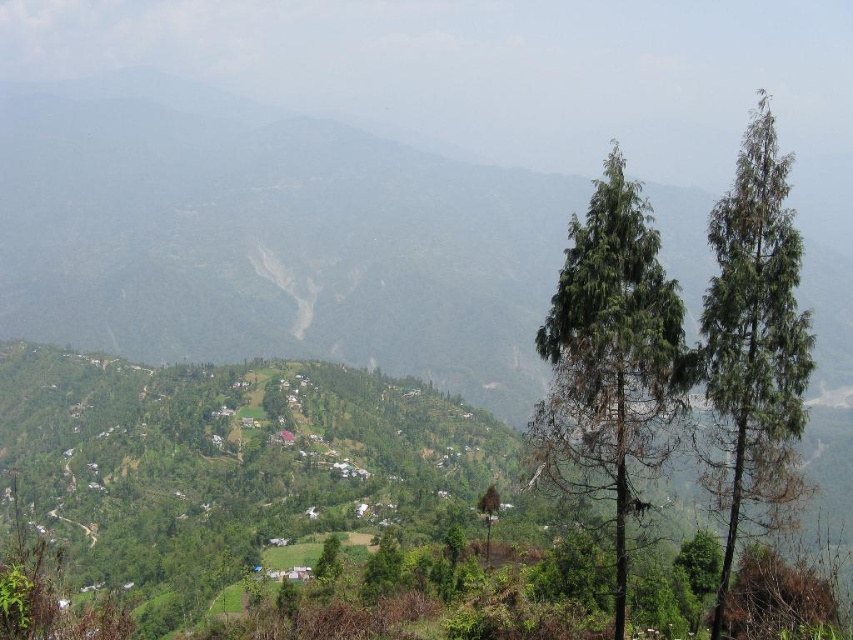
Question: Which object is closer to the camera taking this photo?

Choices:
 (A) green needle-like tree at right
 (B) green matte tree at right

Answer: (B)

Question: Can you confirm if green leafy mountain at center is wider than green needle-like tree at right?

Choices:
 (A) yes
 (B) no

Answer: (A)

Question: Which point is closer to the camera?

Choices:
 (A) (142, 97)
 (B) (631, 333)
 (C) (718, 637)

Answer: (B)

Question: Which point is closer to the camera?

Choices:
 (A) (778, 339)
 (B) (560, 273)

Answer: (A)

Question: Is green leafy mountain at center closer to the viewer compared to green matte tree at right?

Choices:
 (A) no
 (B) yes

Answer: (B)

Question: Is green leafy mountain at center bigger than green matte tree at right?

Choices:
 (A) no
 (B) yes

Answer: (B)